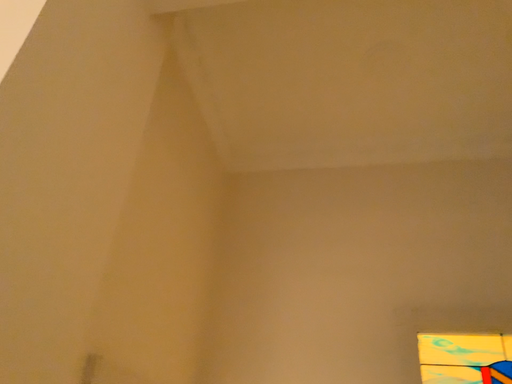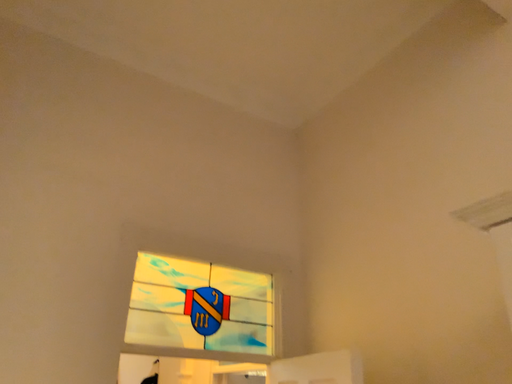
Question: How did the camera likely rotate when shooting the video?

Choices:
 (A) rotated upward
 (B) rotated downward

Answer: (B)